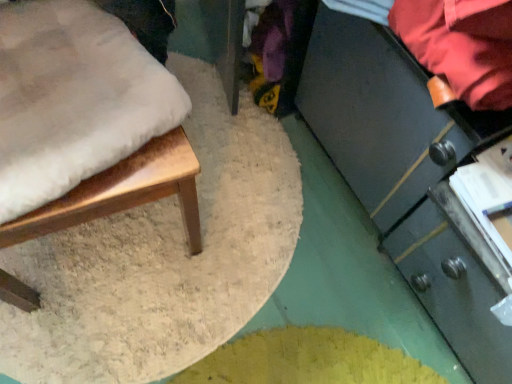
You are a GUI agent. You are given a task and a screenshot of the screen. Output one action in this format:
    pyautogui.click(x=<x>, y=<y>)
    Task: Click on the soft white cushion at left
    Image resolution: width=512 pixels, height=384 pixels.
    Given the screenshot: What is the action you would take?
    pyautogui.click(x=123, y=192)

What do you see at coordinates (123, 192) in the screenshot?
I see `soft white cushion at left` at bounding box center [123, 192].

Image resolution: width=512 pixels, height=384 pixels. I want to click on soft white cushion at left, so click(x=123, y=192).